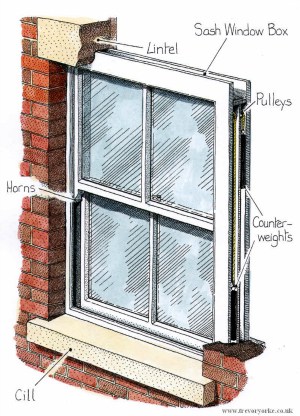
You are a GUI agent. You are given a task and a screenshot of the screen. Output one action in this format:
    pyautogui.click(x=<x>, y=<y>)
    Task: Click on the top left window pane
    
    Given the screenshot: What is the action you would take?
    pyautogui.click(x=118, y=138)